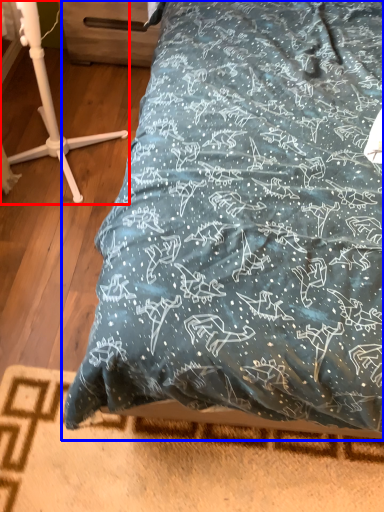
Question: Which object is closer to the camera taking this photo, furniture (highlighted by a red box) or bed (highlighted by a blue box)?

Choices:
 (A) furniture
 (B) bed

Answer: (A)